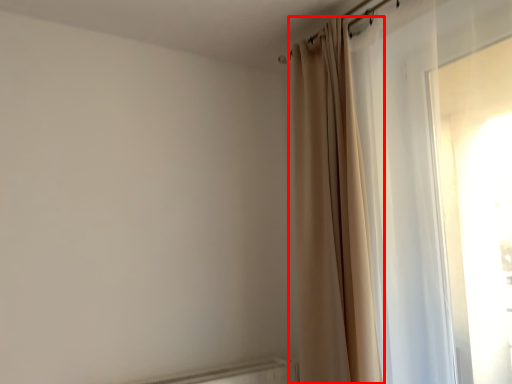
Question: From the image's perspective, considering the relative positions of curtain (annotated by the red box) and curtain in the image provided, where is curtain (annotated by the red box) located with respect to the staircase?

Choices:
 (A) below
 (B) above

Answer: (A)